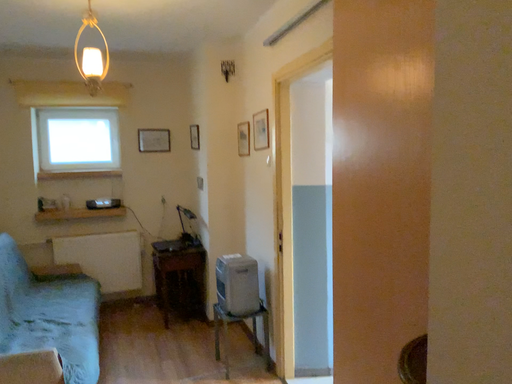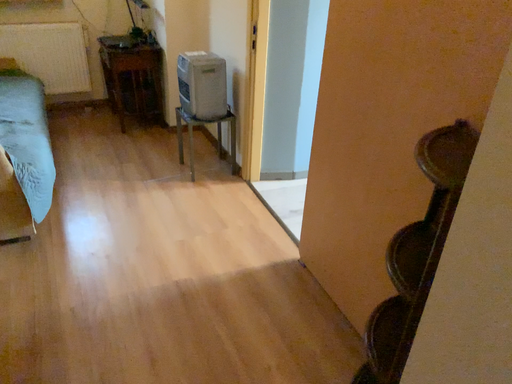
Question: How did the camera likely rotate when shooting the video?

Choices:
 (A) rotated downward
 (B) rotated upward

Answer: (A)